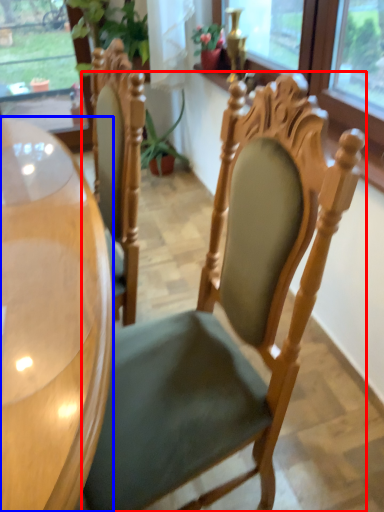
Question: Among these objects, which one is farthest to the camera, chair (highlighted by a red box) or desk (highlighted by a blue box)?

Choices:
 (A) chair
 (B) desk

Answer: (A)